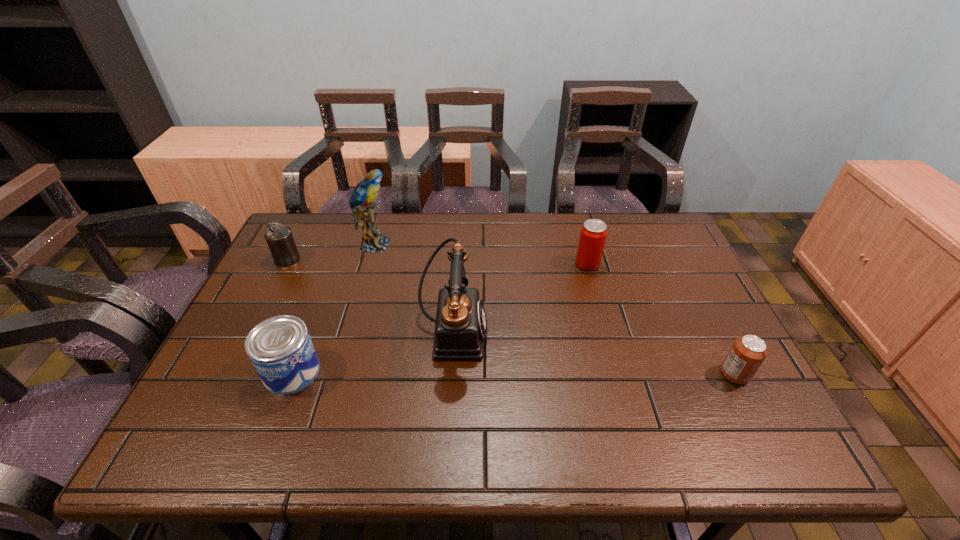
Identify the location of free space that satisfies the following two spatial constraints: 1. on the front label of the rightmost object; 2. on the left side of the third can from right to left. (291, 374).

The width and height of the screenshot is (960, 540). Find the location of `free space in the image that satisfies the following two spatial constraints: 1. on the face of the parrot; 2. on the back side of the rightmost object`. free space in the image that satisfies the following two spatial constraints: 1. on the face of the parrot; 2. on the back side of the rightmost object is located at coordinates (337, 374).

The height and width of the screenshot is (540, 960). I want to click on vacant space that satisfies the following two spatial constraints: 1. on the face of the second object from right to left; 2. on the left side of the tallest object, so click(369, 264).